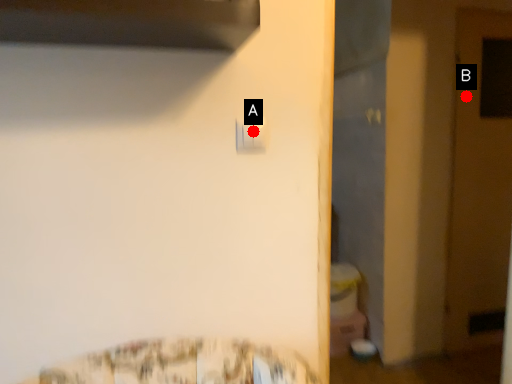
Question: Two points are circled on the image, labeled by A and B beside each circle. Among these points, which one is nearest to the camera?

Choices:
 (A) A is closer
 (B) B is closer

Answer: (A)